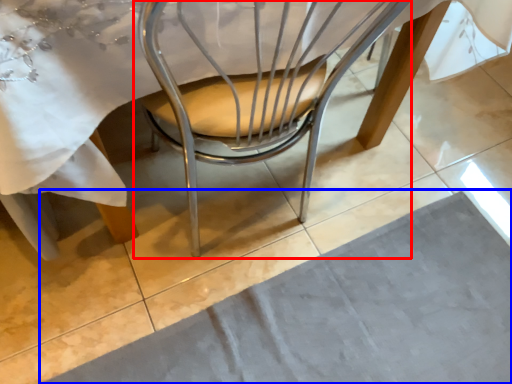
Question: Which object is closer to the camera taking this photo, chair (highlighted by a red box) or place mat (highlighted by a blue box)?

Choices:
 (A) chair
 (B) place mat

Answer: (A)